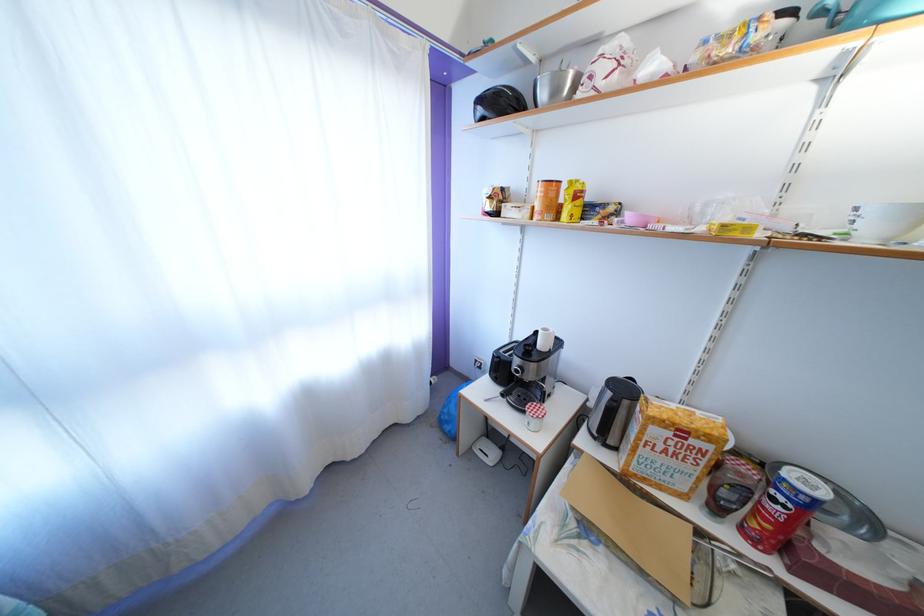
Where is `black kettle handle`? The height and width of the screenshot is (616, 924). black kettle handle is located at coordinates (623, 389).